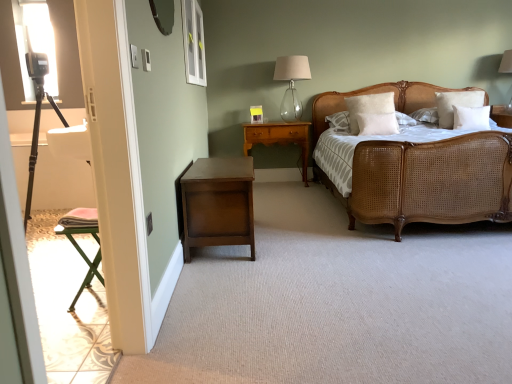
You are a GUI agent. You are given a task and a screenshot of the screen. Output one action in this format:
    pyautogui.click(x=<x>, y=<y>)
    Task: Click on the free point in front of wooden nightstand at center, marked as the second nightstand in a front-to-back arrangement
    The height and width of the screenshot is (384, 512).
    Given the screenshot: What is the action you would take?
    pyautogui.click(x=291, y=190)